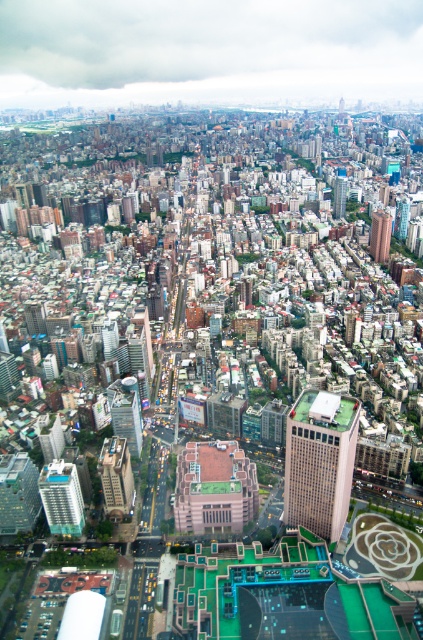
Is matte glass skyscraper at lower left positioned in front of white glossy building at center-left?

No, it is not.

Which is more to the left, matte glass skyscraper at lower left or white glossy building at center-left?

matte glass skyscraper at lower left

The height and width of the screenshot is (640, 423). In order to click on matte glass skyscraper at lower left in this screenshot , I will do `click(18, 493)`.

Which is behind, point (384, 236) or point (332, 204)?

The point (332, 204) is more distant.

Is point (376, 214) more distant than point (345, 204)?

That is False.

Who is more forward, (376, 236) or (334, 216)?

Point (376, 236) is more forward.

Locate an element on the screen. The height and width of the screenshot is (640, 423). brick red building at upper right is located at coordinates (379, 236).

This screenshot has height=640, width=423. Identify the location of brown textured building at center. (214, 488).

The height and width of the screenshot is (640, 423). Describe the element at coordinates (214, 488) in the screenshot. I see `brown textured building at center` at that location.

Who is more forward, [200,442] or [77,522]?

Point [77,522] is more forward.

Where is `brown textured building at center`? This screenshot has height=640, width=423. brown textured building at center is located at coordinates (214, 488).